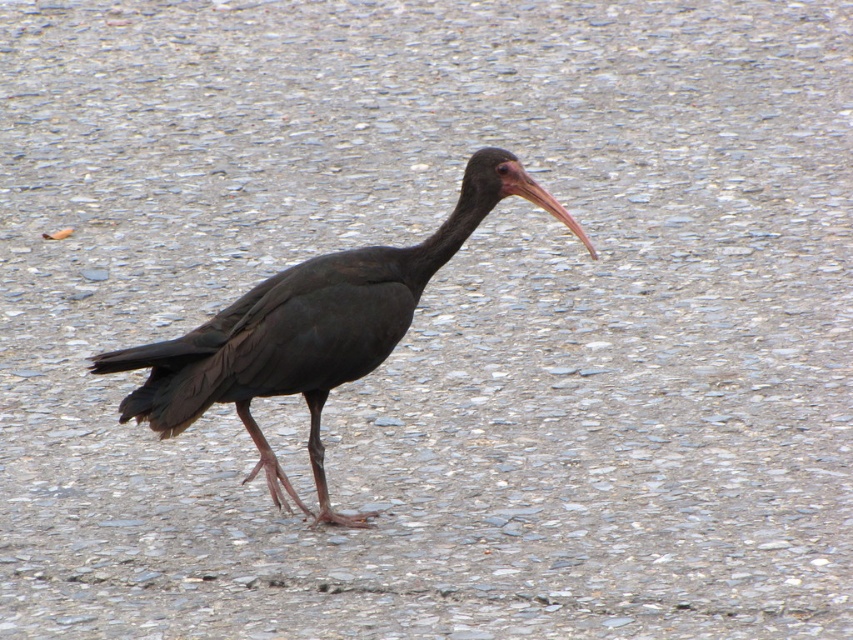
Question: Is shiny black bird at center above matte pink beak at center?

Choices:
 (A) no
 (B) yes

Answer: (A)

Question: Is shiny black bird at center further to camera compared to matte pink beak at center?

Choices:
 (A) no
 (B) yes

Answer: (B)

Question: Which point is closer to the camera?

Choices:
 (A) shiny black bird at center
 (B) matte pink beak at center

Answer: (B)

Question: Which point is farther from the camera taking this photo?

Choices:
 (A) (538, 202)
 (B) (369, 332)

Answer: (B)

Question: Where is shiny black bird at center located in relation to matte pink beak at center in the image?

Choices:
 (A) left
 (B) right

Answer: (A)

Question: Which object appears closest to the camera in this image?

Choices:
 (A) matte pink beak at center
 (B) shiny black bird at center

Answer: (A)